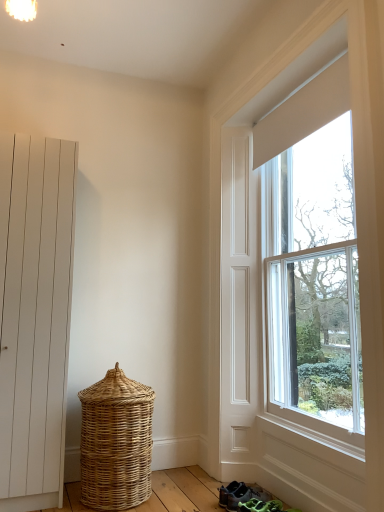
Question: From a real-world perspective, is white matte door at left on top of clear glass window at right?

Choices:
 (A) no
 (B) yes

Answer: (A)

Question: From the image's perspective, is white matte door at left located above clear glass window at right?

Choices:
 (A) yes
 (B) no

Answer: (B)

Question: Is clear glass window at right surrounded by white matte door at left?

Choices:
 (A) no
 (B) yes

Answer: (A)

Question: Is white matte door at left shorter than clear glass window at right?

Choices:
 (A) no
 (B) yes

Answer: (B)

Question: Considering the relative positions of white matte door at left and clear glass window at right in the image provided, is white matte door at left to the left of clear glass window at right from the viewer's perspective?

Choices:
 (A) yes
 (B) no

Answer: (A)

Question: Considering the positions of white matte door at left and gray fabric sneakers at lower center in the image, is white matte door at left bigger or smaller than gray fabric sneakers at lower center?

Choices:
 (A) small
 (B) big

Answer: (B)

Question: Is point (31, 411) positioned closer to the camera than point (223, 494)?

Choices:
 (A) farther
 (B) closer

Answer: (B)

Question: From the image's perspective, is white matte door at left located above or below gray fabric sneakers at lower center?

Choices:
 (A) below
 (B) above

Answer: (B)

Question: Relative to gray fabric sneakers at lower center, is white matte door at left in front or behind?

Choices:
 (A) front
 (B) behind

Answer: (A)

Question: Is gray fabric sneakers at lower center spatially inside woven natural basket at lower left, or outside of it?

Choices:
 (A) inside
 (B) outside

Answer: (B)

Question: From the image's perspective, relative to woven natural basket at lower left, is gray fabric sneakers at lower center above or below?

Choices:
 (A) below
 (B) above

Answer: (A)

Question: Would you say gray fabric sneakers at lower center is to the left or to the right of woven natural basket at lower left in the picture?

Choices:
 (A) right
 (B) left

Answer: (A)

Question: From a real-world perspective, is gray fabric sneakers at lower center above or below woven natural basket at lower left?

Choices:
 (A) below
 (B) above

Answer: (A)

Question: In terms of size, does woven natural basket at lower left appear bigger or smaller than gray fabric sneakers at lower center?

Choices:
 (A) big
 (B) small

Answer: (A)

Question: Is point (100, 420) positioned closer to the camera than point (230, 500)?

Choices:
 (A) closer
 (B) farther

Answer: (B)